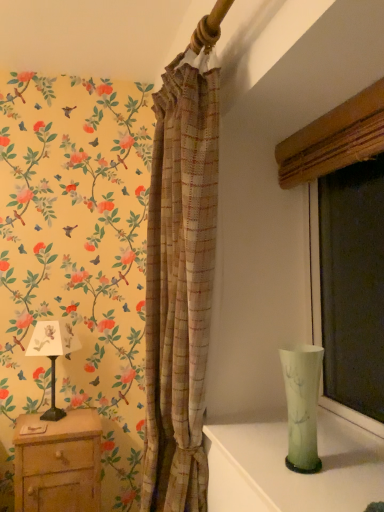
Question: Should I look upward or downward to see green translucent vase at right?

Choices:
 (A) up
 (B) down

Answer: (B)

Question: Is wooden nightstand at lower left not within green glass vase at lower right?

Choices:
 (A) yes
 (B) no

Answer: (A)

Question: Does wooden nightstand at lower left have a greater height compared to green glass vase at lower right?

Choices:
 (A) yes
 (B) no

Answer: (A)

Question: Could green glass vase at lower right be considered to be inside wooden nightstand at lower left?

Choices:
 (A) no
 (B) yes

Answer: (A)

Question: Is wooden nightstand at lower left at the right side of green glass vase at lower right?

Choices:
 (A) yes
 (B) no

Answer: (B)

Question: Can you confirm if wooden nightstand at lower left is shorter than green glass vase at lower right?

Choices:
 (A) no
 (B) yes

Answer: (A)

Question: Does wooden nightstand at lower left have a smaller size compared to green glass vase at lower right?

Choices:
 (A) no
 (B) yes

Answer: (A)

Question: From the image's perspective, is plaid fabric curtain at center on wooden nightstand at lower left?

Choices:
 (A) yes
 (B) no

Answer: (A)

Question: Is plaid fabric curtain at center placed right next to wooden nightstand at lower left?

Choices:
 (A) no
 (B) yes

Answer: (A)

Question: Considering the relative sizes of plaid fabric curtain at center and wooden nightstand at lower left in the image provided, is plaid fabric curtain at center shorter than wooden nightstand at lower left?

Choices:
 (A) no
 (B) yes

Answer: (A)

Question: Is plaid fabric curtain at center positioned with its back to wooden nightstand at lower left?

Choices:
 (A) no
 (B) yes

Answer: (A)

Question: Is plaid fabric curtain at center far from wooden nightstand at lower left?

Choices:
 (A) no
 (B) yes

Answer: (A)

Question: Is plaid fabric curtain at center closer to camera compared to wooden nightstand at lower left?

Choices:
 (A) no
 (B) yes

Answer: (B)

Question: Is matte wood window frame at right facing towards green translucent vase at right?

Choices:
 (A) no
 (B) yes

Answer: (B)